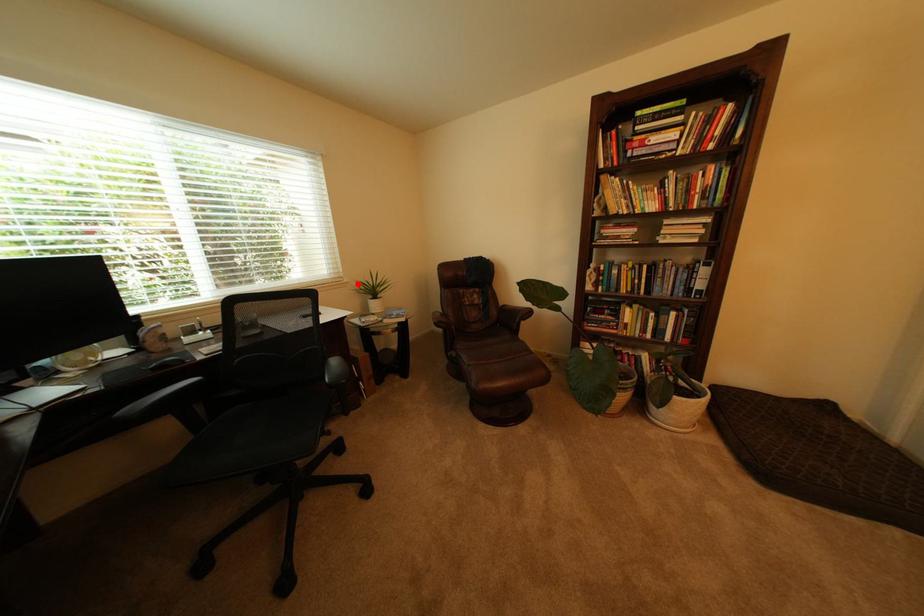
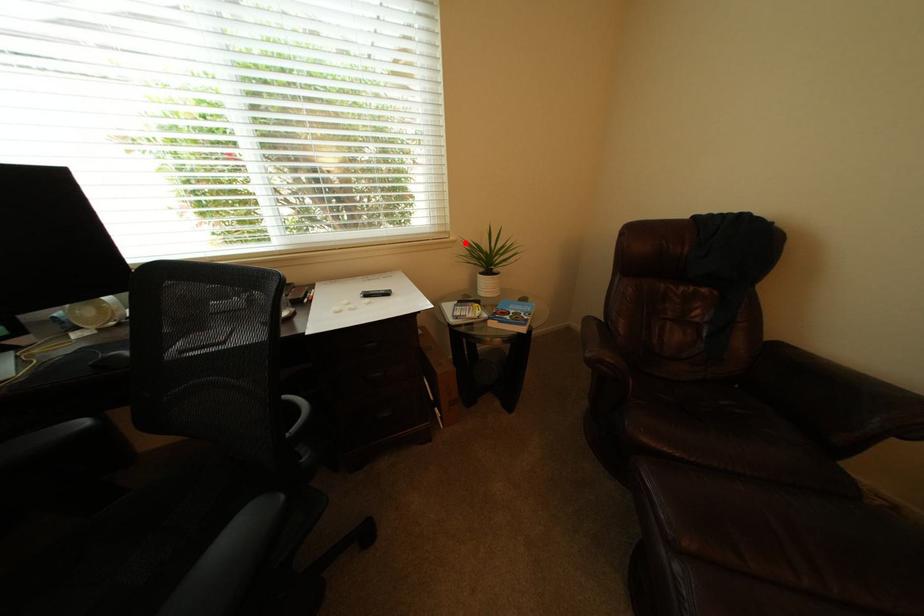
I am providing you with two images of the same scene from different viewpoints. A red point is marked on the first image and another point is marked on the second image. Are the points marked in image1 and image2 representing the same 3D position?

Yes